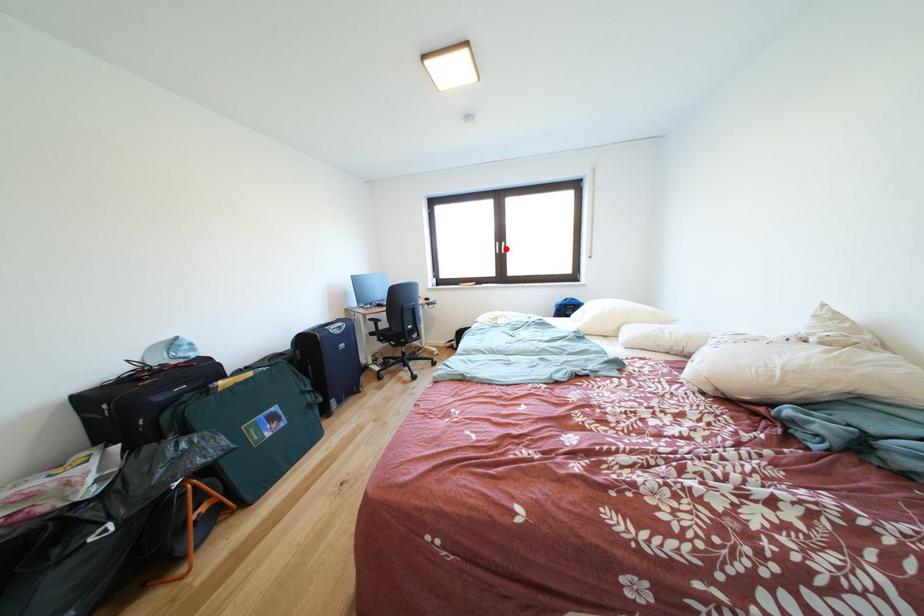
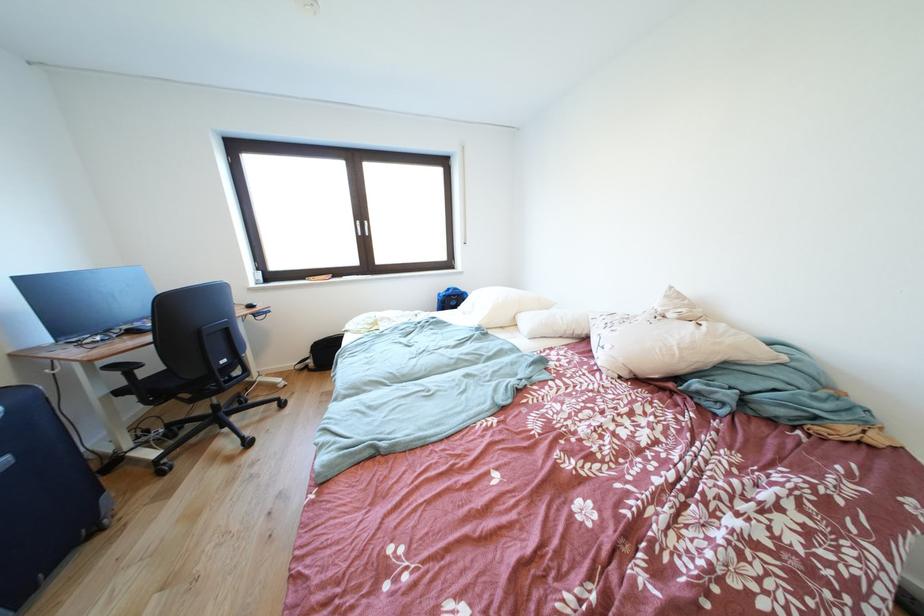
Where in the second image is the point corresponding to the highlighted location from the first image?

(367, 228)